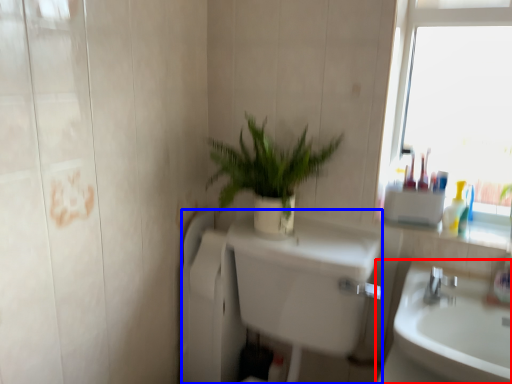
Question: Which point is closer to the camera, sink (highlighted by a red box) or bath (highlighted by a blue box)?

Choices:
 (A) sink
 (B) bath

Answer: (B)